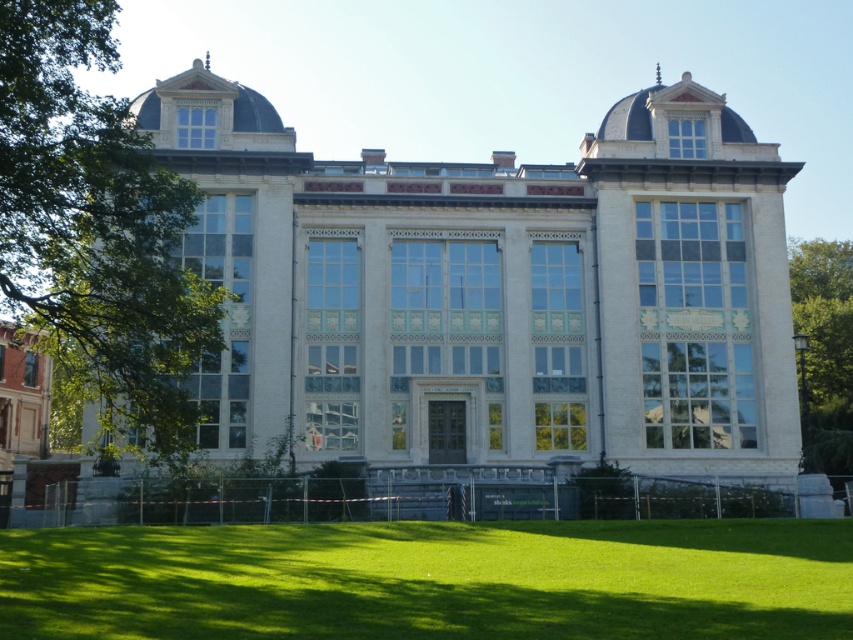
Which is more to the left, green grass at lower center or green leafy tree at left?

green leafy tree at left

Between green grass at lower center and green leafy tree at left, which one is positioned higher?

Positioned higher is green leafy tree at left.

Which is behind, point (91, 531) or point (25, 49)?

The point (91, 531) is behind.

What are the coordinates of `green grass at lower center` in the screenshot? It's located at click(x=431, y=579).

Is green leafy tree at left taller than green leafy tree at right?

Yes, green leafy tree at left is taller than green leafy tree at right.

Describe the element at coordinates (96, 227) in the screenshot. I see `green leafy tree at left` at that location.

Is point (90, 134) positioned after point (807, 342)?

No, it is not.

What are the coordinates of `green leafy tree at left` in the screenshot? It's located at (96, 227).

Who is higher up, green grass at lower center or green leafy tree at right?

green leafy tree at right is higher up.

Can you confirm if green grass at lower center is positioned above green leafy tree at right?

No, green grass at lower center is not above green leafy tree at right.

Locate an element on the screen. This screenshot has height=640, width=853. green grass at lower center is located at coordinates (431, 579).